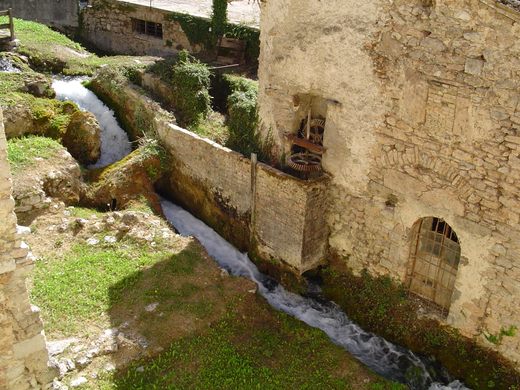
Identify the location of window. (441, 253), (140, 29).